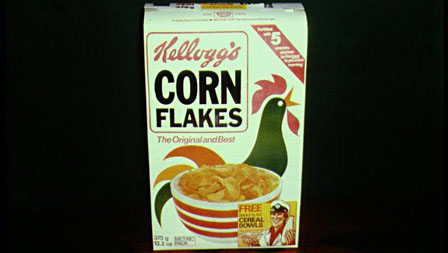
Find the location of a particular element. This screenshot has width=448, height=253. bowl is located at coordinates (207, 211).